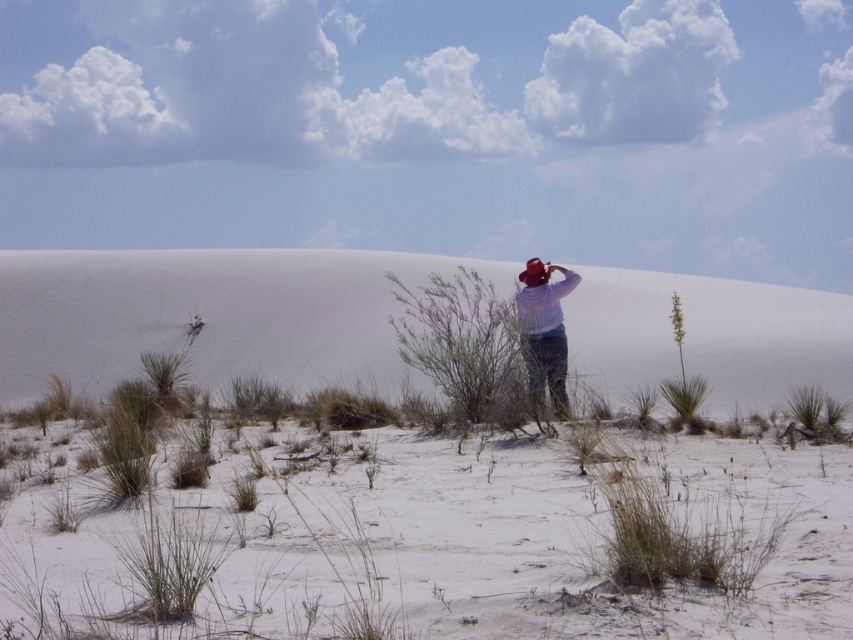
Question: Can you confirm if white sandy at center is bigger than green leafy bush at center?

Choices:
 (A) yes
 (B) no

Answer: (B)

Question: In this image, where is white sand dune at center located relative to plaid shirt at center?

Choices:
 (A) above
 (B) below

Answer: (A)

Question: Which object appears closest to the camera in this image?

Choices:
 (A) white sandy at center
 (B) green leafy bush at center
 (C) plaid shirt at center

Answer: (A)

Question: Is white sandy at center wider than plaid shirt at center?

Choices:
 (A) no
 (B) yes

Answer: (A)

Question: Estimate the real-world distances between objects in this image. Which object is farther from the white sand dune at center?

Choices:
 (A) white sandy at center
 (B) green leafy bush at center

Answer: (A)

Question: Estimate the real-world distances between objects in this image. Which object is closer to the white sand dune at center?

Choices:
 (A) plaid shirt at center
 (B) white sandy at center

Answer: (A)